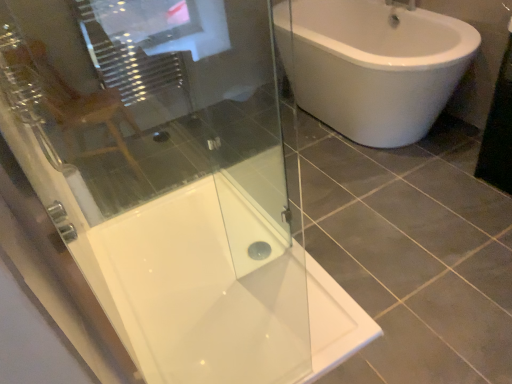
Where is `vacant region under matte wooden chair at upper left (from a real-world perspective)`? The width and height of the screenshot is (512, 384). vacant region under matte wooden chair at upper left (from a real-world perspective) is located at coordinates (111, 168).